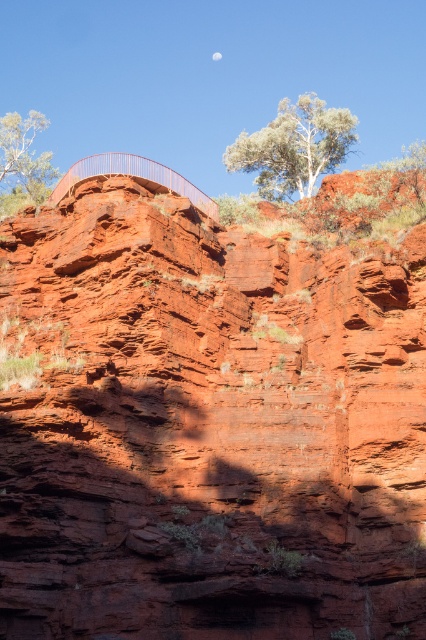
From the picture: You are standing at the cliff edge looking out. There are two points marked on the cliff face. The first is at coordinate point (x=313, y=128) and the second at point (x=172, y=170). Which point is closer to your current position?

Point (x=313, y=128) is in front of point (x=172, y=170), so it is closer to your current position at the cliff edge.

You are a hiker standing at the edge of the cliff looking at the white textured tree at upper center and the metallic railing at upper center. Which object is taller?

The white textured tree at upper center is taller than the metallic railing at upper center.